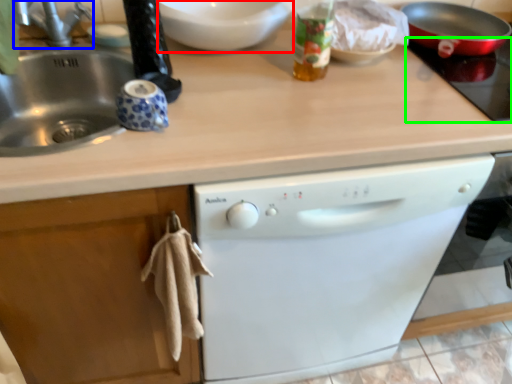
Question: Based on their relative distances, which object is nearer to mixing bowl (highlighted by a red box)? Choose from faucet (highlighted by a blue box) and gas stove (highlighted by a green box).

Choices:
 (A) faucet
 (B) gas stove

Answer: (A)